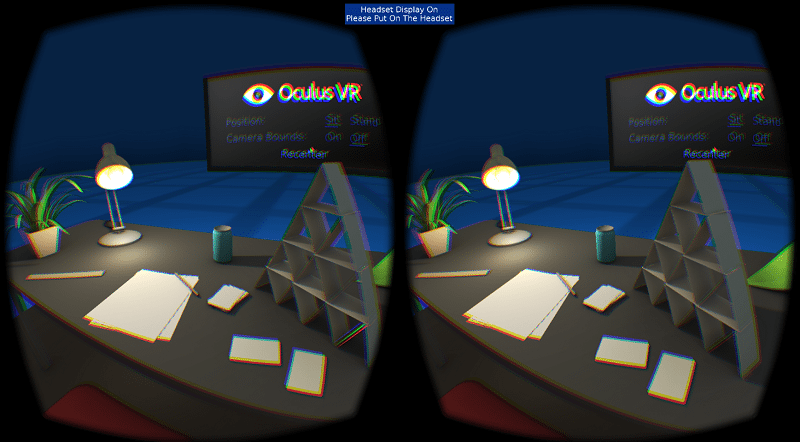
Identify the location of bulb. The image size is (800, 442). (496, 170).